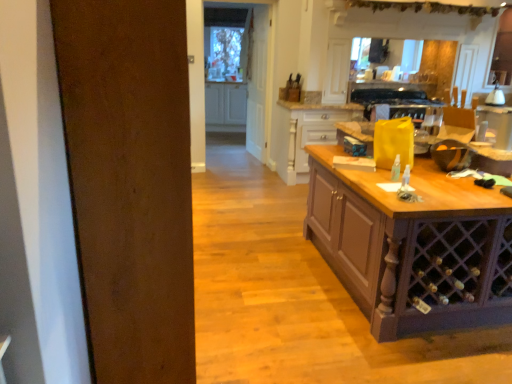
Question: Based on their positions, is clear glass door at center located to the left or right of wooden drawer at center, the second cabinetry viewed from the back?

Choices:
 (A) right
 (B) left

Answer: (B)

Question: Considering the positions of point (261, 72) and point (318, 112), is point (261, 72) closer or farther from the camera than point (318, 112)?

Choices:
 (A) closer
 (B) farther

Answer: (B)

Question: Which is nearer to the white glossy lamp at upper right?

Choices:
 (A) white wood door at center
 (B) white glossy cabinet at center, which is the 2th cabinetry from right to left
 (C) clear glass door at center
 (D) wooden table at right
 (E) black glass oven at upper center

Answer: (D)

Question: Estimate the real-world distances between objects in this image. Which object is farther from the white glossy cabinet at center, the 1th cabinetry positioned from the left?

Choices:
 (A) white glossy lamp at upper right
 (B) wooden drawer at center, the second cabinetry viewed from the back
 (C) white wood door at center
 (D) wooden table at right
 (E) black glass oven at upper center

Answer: (D)